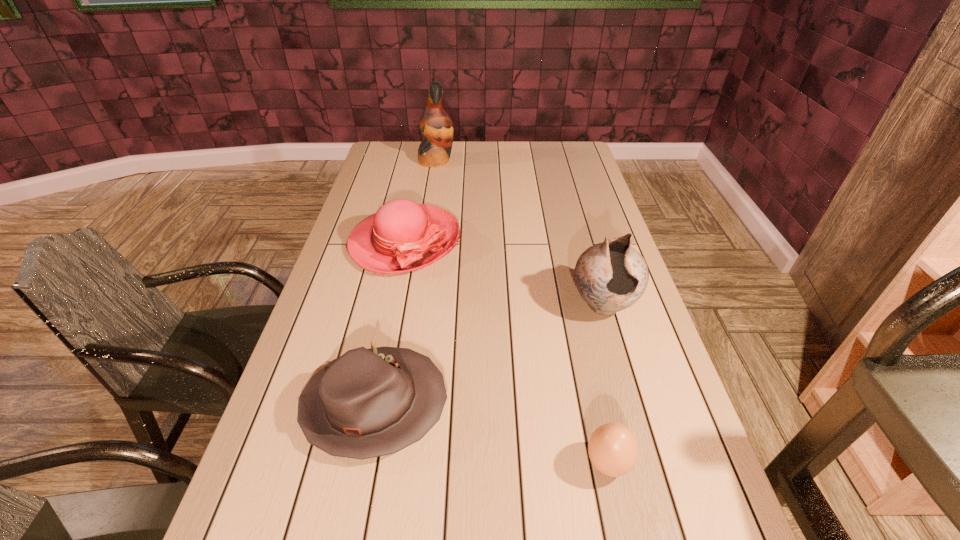
This screenshot has width=960, height=540. Find the location of `the closest object to the pottery`. the closest object to the pottery is located at coordinates (612, 448).

Choose which object is the nearest neighbor to the parrot. Please provide its 2D coordinates. Your answer should be formatted as a tuple, i.e. [(x, y)], where the tuple contains the x and y coordinates of a point satisfying the conditions above.

[(402, 236)]

At what (x,y) coordinates should I click in order to perform the action: click on blank area in the image that satisfies the following two spatial constraints: 1. at the front of the second farthest object with a bow; 2. on the left side of the boiled egg. Please return your answer as a coordinate pair (x, y). Looking at the image, I should click on (359, 463).

You are a GUI agent. You are given a task and a screenshot of the screen. Output one action in this format:
    pyautogui.click(x=<x>, y=<y>)
    Task: Click on the vacant region that satisfies the following two spatial constraints: 1. on the decorative side of the boiled egg; 2. on the right side of the nearer hat
    Image resolution: width=960 pixels, height=540 pixels.
    Given the screenshot: What is the action you would take?
    pyautogui.click(x=363, y=463)

Where is `free spot that satisfies the following two spatial constraints: 1. on the decorative side of the nearer hat; 2. on the left side of the boiled egg`? This screenshot has width=960, height=540. free spot that satisfies the following two spatial constraints: 1. on the decorative side of the nearer hat; 2. on the left side of the boiled egg is located at coordinates (363, 463).

I want to click on free spot that satisfies the following two spatial constraints: 1. at the front of the boiled egg with a bow; 2. on the left side of the farther hat, so click(x=359, y=463).

Locate an element on the screen. Image resolution: width=960 pixels, height=540 pixels. vacant space that satisfies the following two spatial constraints: 1. on the face of the parrot; 2. on the right side of the boiled egg is located at coordinates (390, 463).

Find the location of `blank space that satisfies the following two spatial constraints: 1. on the face of the boiled egg; 2. on the left side of the farthest object`. blank space that satisfies the following two spatial constraints: 1. on the face of the boiled egg; 2. on the left side of the farthest object is located at coordinates (390, 463).

Find the location of a particular element. The width and height of the screenshot is (960, 540). vacant space that satisfies the following two spatial constraints: 1. from the spout of the fourth shortest object; 2. on the decorative side of the nearer hat is located at coordinates (632, 405).

The width and height of the screenshot is (960, 540). Find the location of `free point that satisfies the following two spatial constraints: 1. on the decorative side of the boiled egg; 2. on the left side of the shorter hat`. free point that satisfies the following two spatial constraints: 1. on the decorative side of the boiled egg; 2. on the left side of the shorter hat is located at coordinates (363, 463).